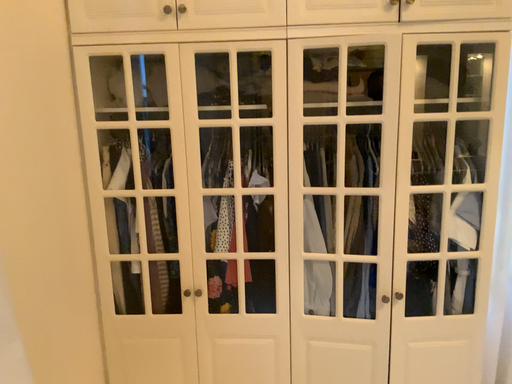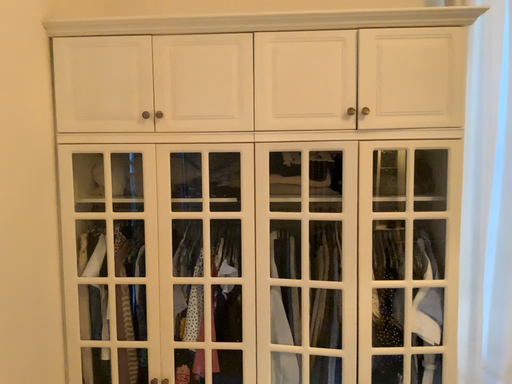
Question: Which way did the camera rotate in the video?

Choices:
 (A) rotated downward
 (B) rotated upward

Answer: (B)